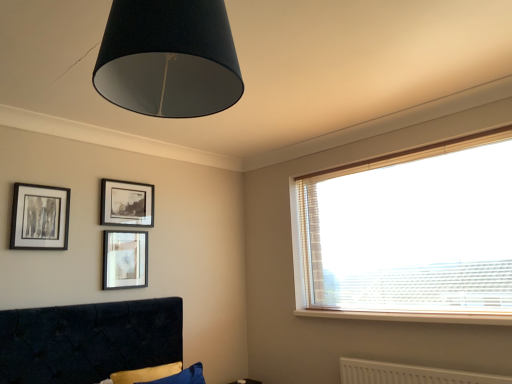
Question: Are velvet dark blue bed at lower left and white textured radiator at lower right located far from each other?

Choices:
 (A) no
 (B) yes

Answer: (B)

Question: Is velvet dark blue bed at lower left taller than white textured radiator at lower right?

Choices:
 (A) yes
 (B) no

Answer: (A)

Question: Does velvet dark blue bed at lower left have a larger size compared to white textured radiator at lower right?

Choices:
 (A) yes
 (B) no

Answer: (A)

Question: Does velvet dark blue bed at lower left have a lesser width compared to white textured radiator at lower right?

Choices:
 (A) no
 (B) yes

Answer: (A)

Question: Considering the relative sizes of velvet dark blue bed at lower left and white textured radiator at lower right in the image provided, is velvet dark blue bed at lower left wider than white textured radiator at lower right?

Choices:
 (A) no
 (B) yes

Answer: (B)

Question: From the image's perspective, is velvet dark blue bed at lower left over white textured radiator at lower right?

Choices:
 (A) no
 (B) yes

Answer: (B)

Question: Considering the relative sizes of white glossy table at lower center and black glossy picture frame at upper center, the second picture frame viewed from the left, in the image provided, is white glossy table at lower center taller than black glossy picture frame at upper center, the second picture frame viewed from the left,?

Choices:
 (A) yes
 (B) no

Answer: (B)

Question: Does white glossy table at lower center have a smaller size compared to black glossy picture frame at upper center, the second picture frame viewed from the left?

Choices:
 (A) no
 (B) yes

Answer: (B)

Question: Is black glossy picture frame at upper center, the second picture frame viewed from the left, a part of white glossy table at lower center?

Choices:
 (A) yes
 (B) no

Answer: (B)

Question: Is white glossy table at lower center far from black glossy picture frame at upper center, the second picture frame viewed from the left?

Choices:
 (A) no
 (B) yes

Answer: (B)

Question: From the image's perspective, would you say white glossy table at lower center is positioned over black glossy picture frame at upper center, acting as the 2th picture frame starting from the right?

Choices:
 (A) yes
 (B) no

Answer: (B)

Question: Is white glossy table at lower center further to the viewer compared to black glossy picture frame at upper center, the second picture frame viewed from the left?

Choices:
 (A) no
 (B) yes

Answer: (B)

Question: Is white wood window sill at lower right shorter than white textured radiator at lower right?

Choices:
 (A) no
 (B) yes

Answer: (B)